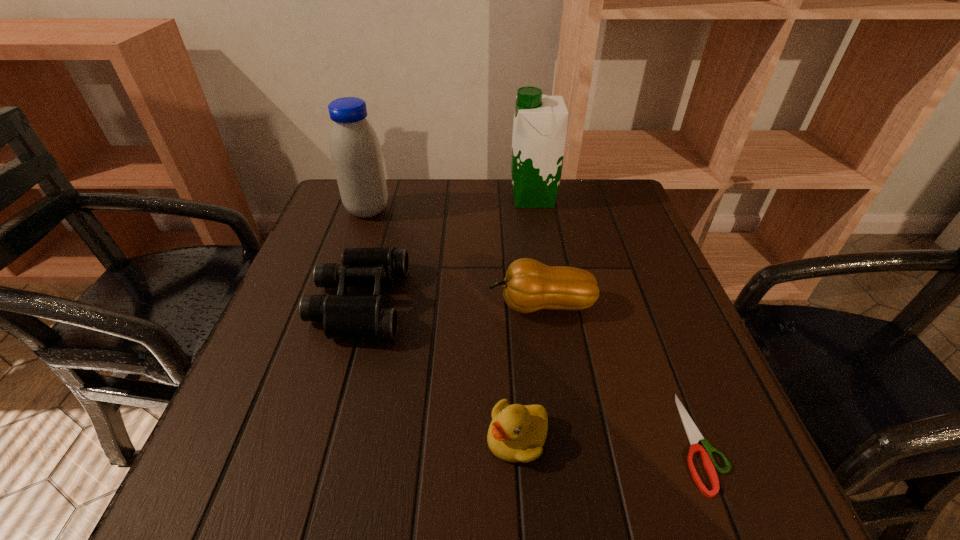
This screenshot has height=540, width=960. Identify the location of scissors at the near edge. (694, 436).

Locate an element on the screen. The width and height of the screenshot is (960, 540). soya milk positioned at the left edge is located at coordinates (356, 154).

The width and height of the screenshot is (960, 540). I want to click on binoculars that is positioned at the left edge, so click(x=352, y=317).

At what (x,y) coordinates should I click in order to perform the action: click on object located at the right edge. Please return your answer as a coordinate pair (x, y). Looking at the image, I should click on (694, 436).

Find the location of a particular element. The height and width of the screenshot is (540, 960). object that is at the far left corner is located at coordinates (356, 154).

Image resolution: width=960 pixels, height=540 pixels. I want to click on object at the near right corner, so [x=694, y=436].

Identify the location of free point at the far edge. This screenshot has height=540, width=960. (460, 205).

Image resolution: width=960 pixels, height=540 pixels. In the image, there is a desktop. What are the coordinates of `free space at the left edge` in the screenshot? It's located at (291, 418).

The image size is (960, 540). Identify the location of blank area at the right edge. (640, 323).

Identify the location of free region at the far left corner. Image resolution: width=960 pixels, height=540 pixels. (322, 222).